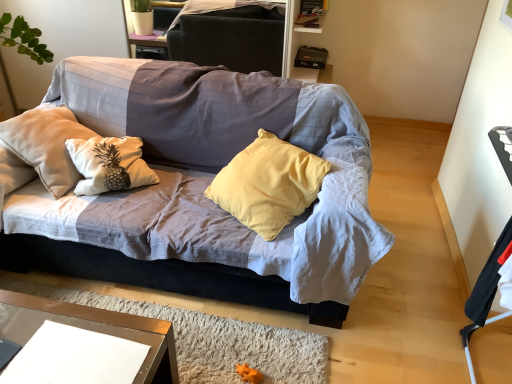
Where is `free spot above clear glass table at lower left (from a real-world perspective)`? free spot above clear glass table at lower left (from a real-world perspective) is located at coordinates (59, 332).